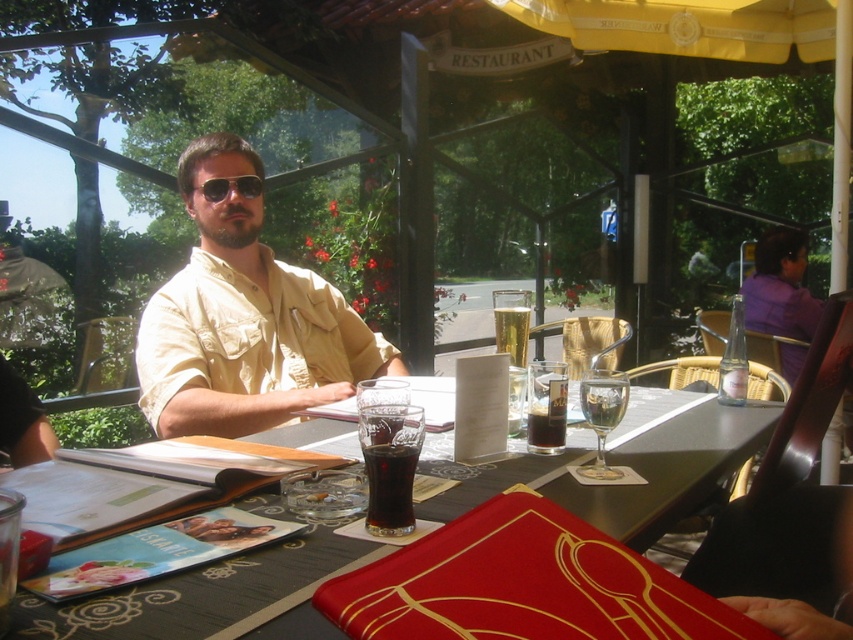
Is the position of beige cotton shirt at center more distant than that of dark brown glass at table center?

Yes.

Between beige cotton shirt at center and dark brown glass at table center, which one has less height?

With less height is dark brown glass at table center.

Between point (238, 349) and point (544, 433), which one is positioned in front?

Point (544, 433) is more forward.

In order to click on beige cotton shirt at center in this screenshot , I will do `click(244, 321)`.

Does clear glass wine glass at table center have a lesser height compared to dark brown glass at table center?

In fact, clear glass wine glass at table center may be taller than dark brown glass at table center.

Is clear glass wine glass at table center to the right of dark brown glass at table center from the viewer's perspective?

Yes, clear glass wine glass at table center is to the right of dark brown glass at table center.

Who is more distant from viewer, (607,380) or (546,406)?

The point (546,406) is behind.

Find the location of a particular element. clear glass wine glass at table center is located at coordinates (602, 413).

Between point (33, 637) and point (280, 324), which one is positioned behind?

The point (280, 324) is behind.

This screenshot has height=640, width=853. Describe the element at coordinates (207, 598) in the screenshot. I see `matte glass table at center` at that location.

At what (x,y) coordinates should I click in order to perform the action: click on matte glass table at center. Please return your answer as a coordinate pair (x, y). The width and height of the screenshot is (853, 640). Looking at the image, I should click on (207, 598).